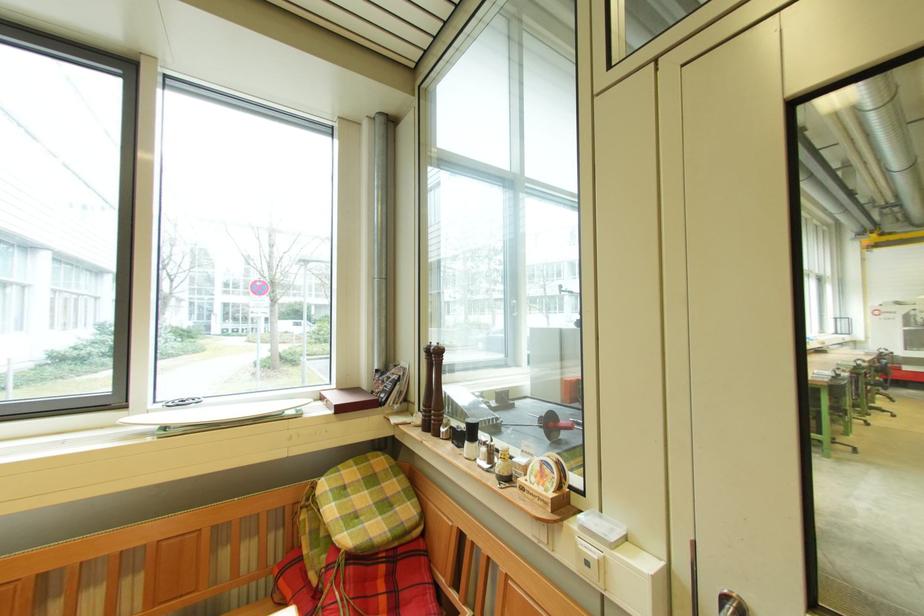
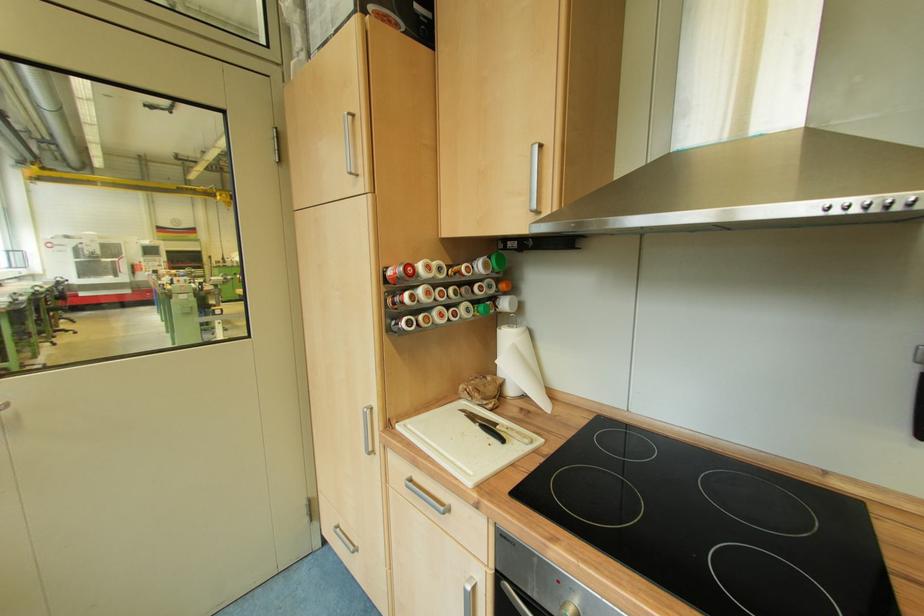
Question: The images are taken continuously from a first-person perspective. In which direction is your viewpoint rotating?

Choices:
 (A) Left
 (B) Right
 (C) Up
 (D) Down

Answer: (B)